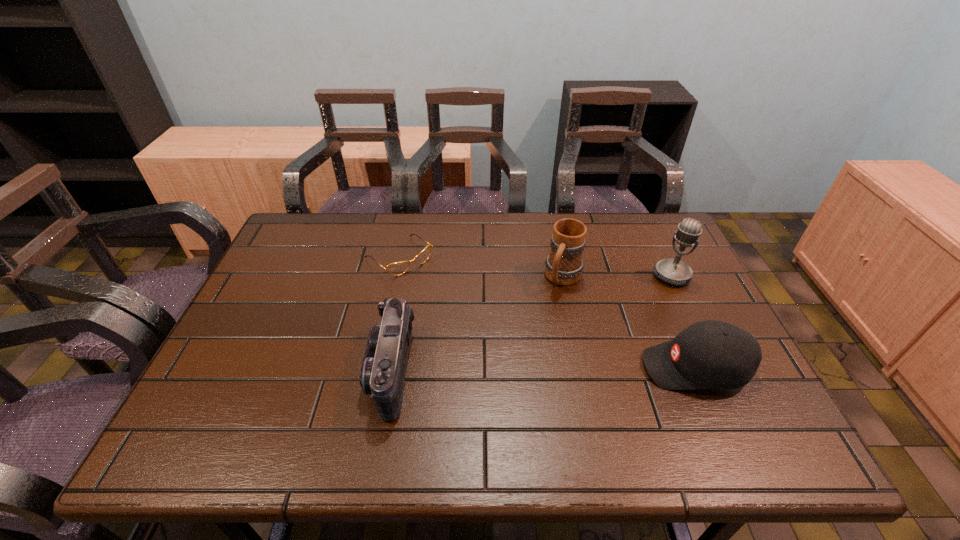
This screenshot has height=540, width=960. I want to click on free space on the desktop that is between the camcorder and the baseball cap and is positioned on the front-facing side of the tallest object, so click(x=583, y=368).

Identify the location of free space on the desktop that is between the camcorder and the baseball cap and is positioned on the side of the fourth shortest object with the handle. The width and height of the screenshot is (960, 540). (512, 369).

Locate an element on the screen. vacant space on the desktop that is between the camcorder and the baseball cap and is positioned on the front-facing side of the shortest object is located at coordinates (527, 369).